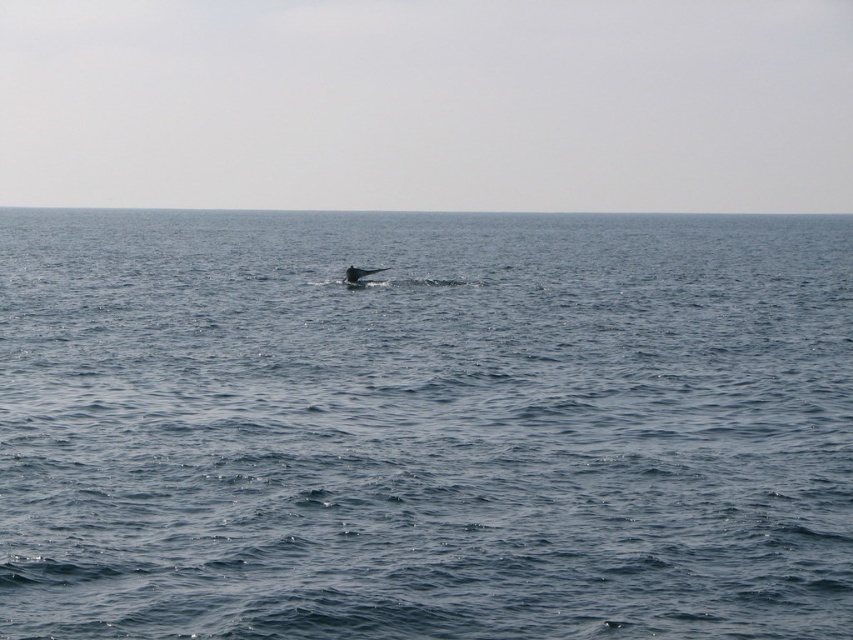
Question: Can you confirm if blue water at center is positioned below gray matte whale at center?

Choices:
 (A) no
 (B) yes

Answer: (A)

Question: Does blue water at center appear on the right side of gray matte whale at center?

Choices:
 (A) yes
 (B) no

Answer: (B)

Question: Which object appears farthest from the camera in this image?

Choices:
 (A) blue water at center
 (B) gray matte whale at center

Answer: (B)

Question: Which of the following is the closest to the observer?

Choices:
 (A) (749, 540)
 (B) (345, 280)

Answer: (A)

Question: Which of the following is the closest to the observer?

Choices:
 (A) (364, 282)
 (B) (607, 589)

Answer: (B)

Question: Considering the relative positions of blue water at center and gray matte whale at center in the image provided, where is blue water at center located with respect to gray matte whale at center?

Choices:
 (A) left
 (B) right

Answer: (A)